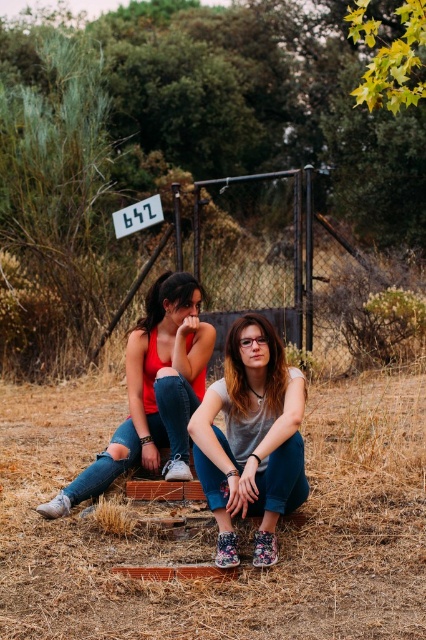
Between matte gray shirt at center and matte red tank top at left, which one has less height?

matte gray shirt at center is shorter.

Is matte gray shirt at center thinner than matte red tank top at left?

Yes, matte gray shirt at center is thinner than matte red tank top at left.

Between point (236, 321) and point (149, 312), which one is positioned behind?

The point (149, 312) is behind.

Locate an element on the screen. This screenshot has width=426, height=640. matte gray shirt at center is located at coordinates (252, 440).

Who is more distant from viewer, (299, 416) or (149, 204)?

Point (149, 204)

Between point (262, 424) and point (134, 221), which one is positioned behind?

The point (134, 221) is behind.

Locate an element on the screen. Image resolution: width=426 pixels, height=640 pixels. matte gray shirt at center is located at coordinates point(252,440).

Who is lower down, matte red tank top at left or white plastic sign at center?

matte red tank top at left is lower down.

Can you confirm if matte red tank top at left is positioned above white plastic sign at center?

No, matte red tank top at left is not above white plastic sign at center.

I want to click on matte red tank top at left, so click(152, 392).